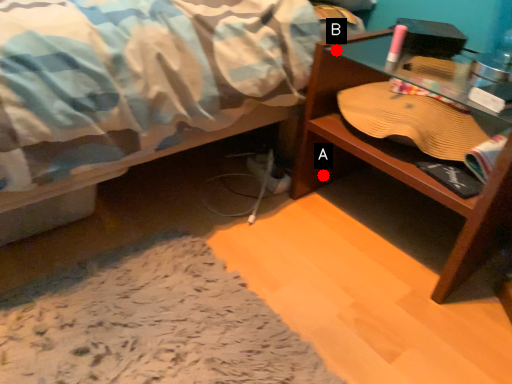
Question: Two points are circled on the image, labeled by A and B beside each circle. Which point is farther to the camera?

Choices:
 (A) A is further
 (B) B is further

Answer: (A)